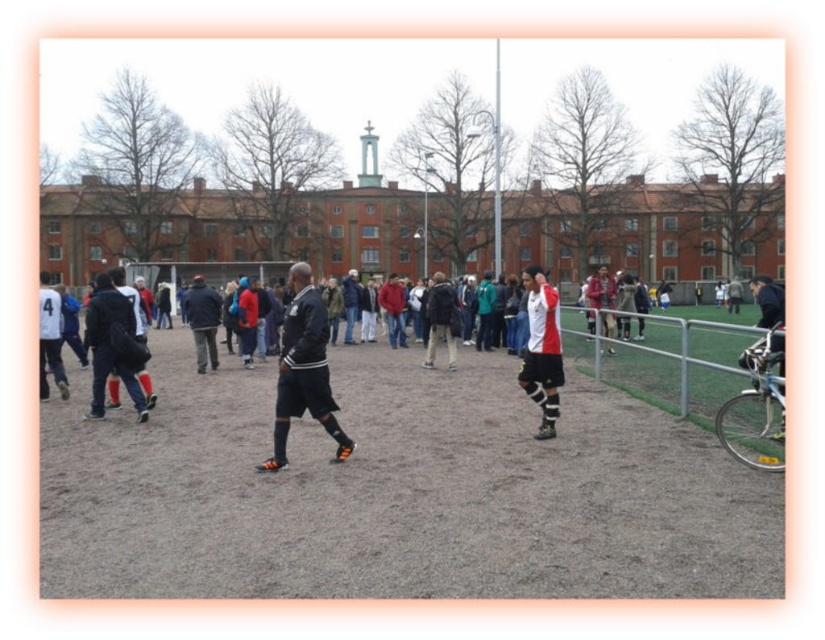
Question: Is brown dirt field at center wider than white and red jersey at center?

Choices:
 (A) yes
 (B) no

Answer: (A)

Question: Which object appears closest to the camera in this image?

Choices:
 (A) brown dirt field at center
 (B) white and red jersey at center
 (C) black leather jacket at center

Answer: (A)

Question: Is brown dirt field at center below black leather jacket at center?

Choices:
 (A) no
 (B) yes

Answer: (B)

Question: Does black leather jacket at center appear on the right side of white and red jersey at center?

Choices:
 (A) no
 (B) yes

Answer: (A)

Question: Which object is the farthest from the brown dirt field at center?

Choices:
 (A) white and red jersey at center
 (B) black leather jacket at center

Answer: (A)

Question: Which point is closer to the camera?

Choices:
 (A) (309, 568)
 (B) (545, 307)

Answer: (A)